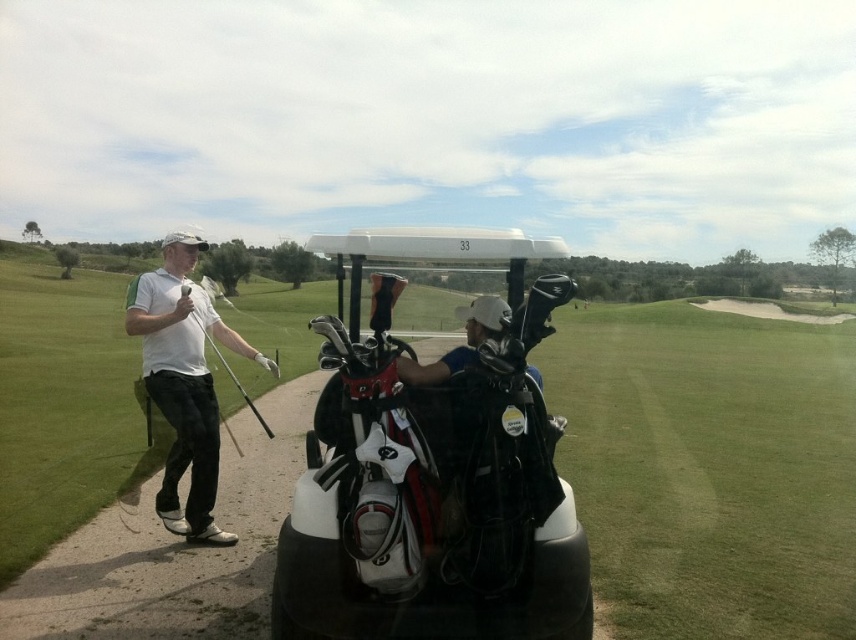
You are a golfer standing on the paved path to the left of the white matte golf cart at center. You want to retrieve your golf bag from the cart. Considering your height is 1.75 meters, can you comfortably reach the golf bags on the cart without needing a ladder?

The white matte golf cart at center is 2.58 meters from viewer. Since the cart is 2.58 meters away, and your height is 1.75 meters, you can comfortably reach the golf bags on the cart without needing a ladder because the distance is within a manageable range for reaching.

You are a golfer who wants to hit the ball onto the green grass golf course at center. You have a matte black golf club at left in your hand. Based on their positions, which object is higher in the image?

The green grass golf course at center is higher than the matte black golf club at left in the image.

You are standing at the golf cart with the number 33 on its roof and want to determine which of the two points, point (302, 548) or point (209, 424), is closer to you. According to the scene description, which point is nearer?

Point (302, 548) is closer to the camera than point (209, 424), so it is the nearer point.